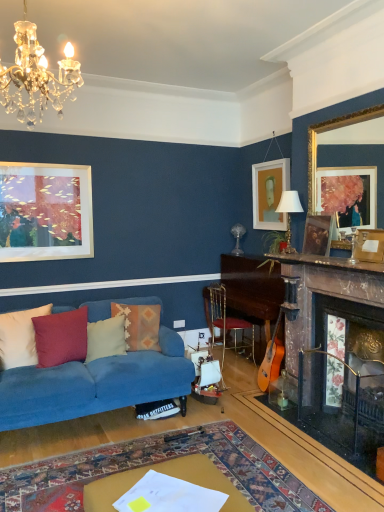
Question: Does white matte picture frame at upper center, the first picture frame from the back, come behind white soft cushion at left, the first pillow from the left?

Choices:
 (A) yes
 (B) no

Answer: (A)

Question: Is white soft cushion at left, the first pillow from the left, at the back of white matte picture frame at upper center, which is counted as the fourth picture frame, starting from the front?

Choices:
 (A) yes
 (B) no

Answer: (B)

Question: Considering the relative positions of white matte picture frame at upper center, the first picture frame from the back, and white soft cushion at left, placed as the 4th pillow when sorted from right to left, in the image provided, is white matte picture frame at upper center, the first picture frame from the back, to the right of white soft cushion at left, placed as the 4th pillow when sorted from right to left, from the viewer's perspective?

Choices:
 (A) yes
 (B) no

Answer: (A)

Question: From the image's perspective, is white matte picture frame at upper center, which is counted as the fourth picture frame, starting from the front, below white soft cushion at left, placed as the 4th pillow when sorted from right to left?

Choices:
 (A) no
 (B) yes

Answer: (A)

Question: Is white matte picture frame at upper center, the first picture frame from the back, bigger than white soft cushion at left, placed as the 4th pillow when sorted from right to left?

Choices:
 (A) yes
 (B) no

Answer: (A)

Question: In terms of height, does velvet cushion at left, which is the third pillow in right-to-left order, look taller or shorter compared to gold-framed mirror at upper right, the 1th picture frame viewed from the front?

Choices:
 (A) short
 (B) tall

Answer: (A)

Question: From a real-world perspective, is velvet cushion at left, which is the third pillow in right-to-left order, above or below gold-framed mirror at upper right, which ranks as the 4th picture frame in back-to-front order?

Choices:
 (A) below
 (B) above

Answer: (A)

Question: In the image, is velvet cushion at left, which is the third pillow in right-to-left order, positioned in front of or behind gold-framed mirror at upper right, which ranks as the 4th picture frame in back-to-front order?

Choices:
 (A) behind
 (B) front

Answer: (A)

Question: Is velvet cushion at left, the second pillow in the left-to-right sequence, bigger or smaller than gold-framed mirror at upper right, which ranks as the 4th picture frame in back-to-front order?

Choices:
 (A) small
 (B) big

Answer: (A)

Question: From their relative heights in the image, would you say wooden fireplace at right is taller or shorter than textured woolen pillow at center, which appears as the fourth pillow when viewed from the left?

Choices:
 (A) tall
 (B) short

Answer: (A)

Question: Considering the positions of point (379, 375) and point (153, 322), is point (379, 375) closer or farther from the camera than point (153, 322)?

Choices:
 (A) closer
 (B) farther

Answer: (A)

Question: Looking at their shapes, would you say wooden fireplace at right is wider or thinner than textured woolen pillow at center, which appears as the fourth pillow when viewed from the left?

Choices:
 (A) wide
 (B) thin

Answer: (A)

Question: From the image's perspective, is wooden fireplace at right positioned above or below textured woolen pillow at center, which appears as the fourth pillow when viewed from the left?

Choices:
 (A) below
 (B) above

Answer: (A)

Question: Is gold-framed mirror at upper right, which ranks as the 4th picture frame in back-to-front order, bigger or smaller than blue fabric couch at lower left?

Choices:
 (A) small
 (B) big

Answer: (A)

Question: In terms of width, does gold-framed mirror at upper right, which ranks as the 4th picture frame in back-to-front order, look wider or thinner when compared to blue fabric couch at lower left?

Choices:
 (A) thin
 (B) wide

Answer: (A)